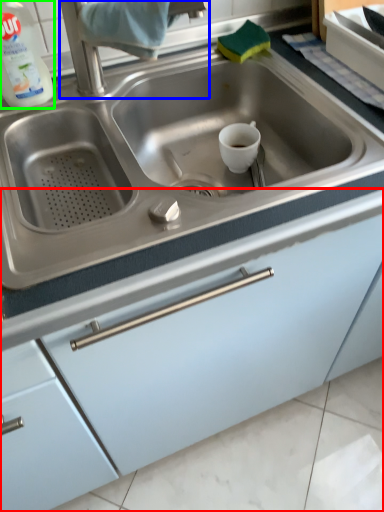
Question: Estimate the real-world distances between objects in this image. Which object is closer to cabinetry (highlighted by a red box), faucet (highlighted by a blue box) or cleaning product (highlighted by a green box)?

Choices:
 (A) faucet
 (B) cleaning product

Answer: (A)